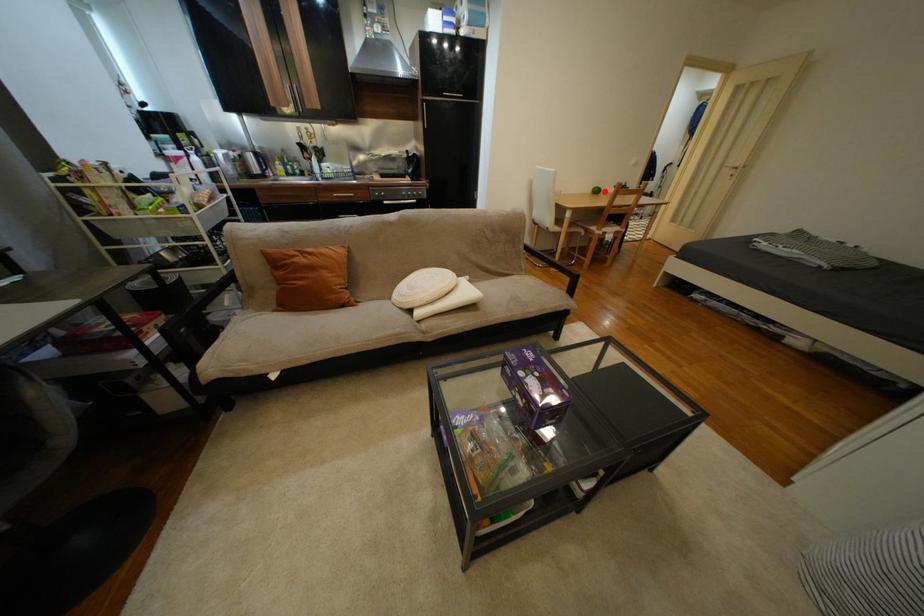
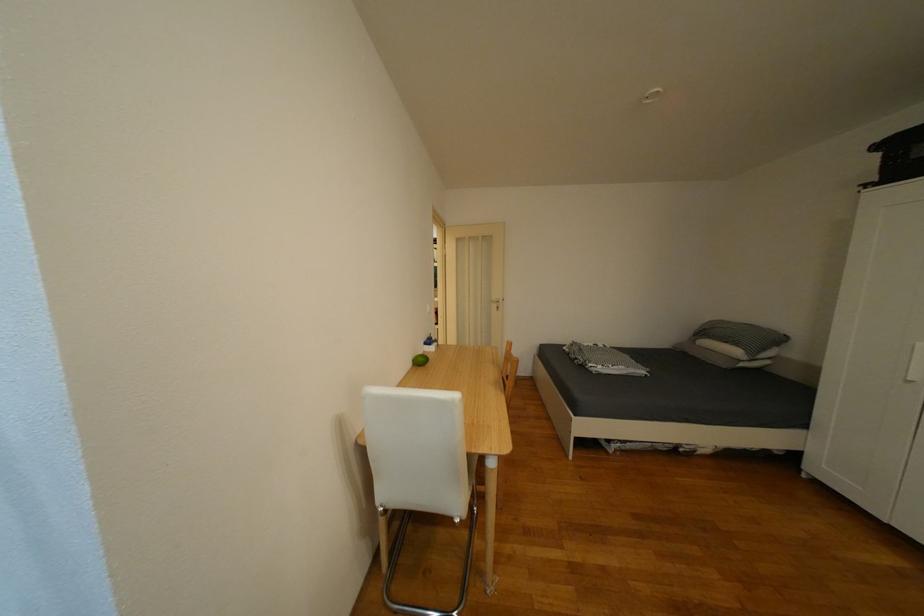
Question: I am providing you with two images of the same scene from different viewpoints. A red point is marked on the first image. At the location where the point appears in image 1, is it still visible in image 2?

Choices:
 (A) Yes
 (B) No

Answer: (A)